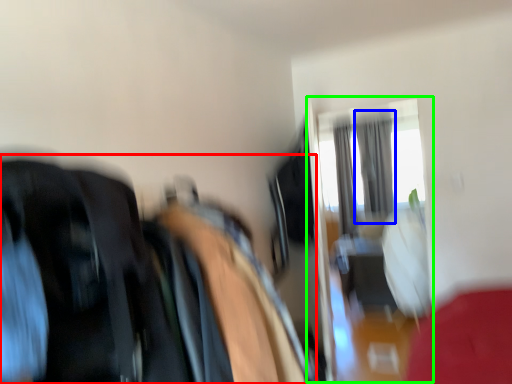
Question: Which object is the farthest from laundry (highlighted by a red box)? Choose among these: curtain (highlighted by a blue box) or glass door (highlighted by a green box).

Choices:
 (A) curtain
 (B) glass door

Answer: (A)